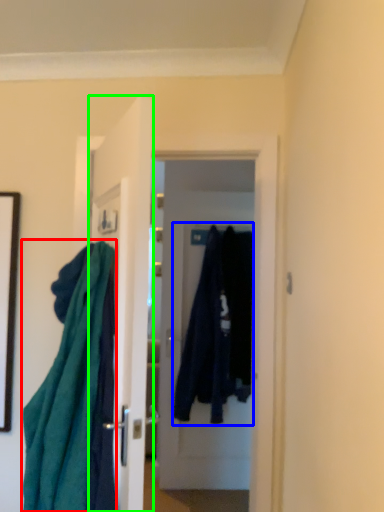
Question: Based on their relative distances, which object is nearer to cloth (highlighted by a red box)? Choose from clothing (highlighted by a blue box) and door (highlighted by a green box).

Choices:
 (A) clothing
 (B) door

Answer: (B)